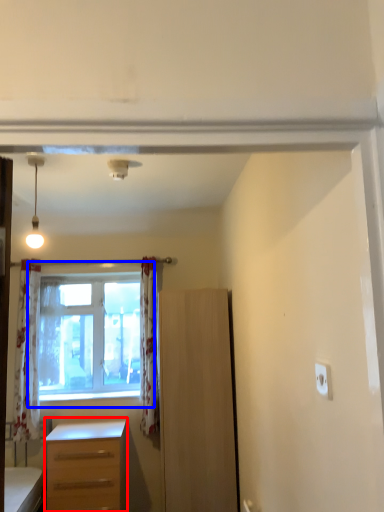
Question: Which point is closer to the camera, desk (highlighted by a red box) or window (highlighted by a blue box)?

Choices:
 (A) desk
 (B) window

Answer: (A)